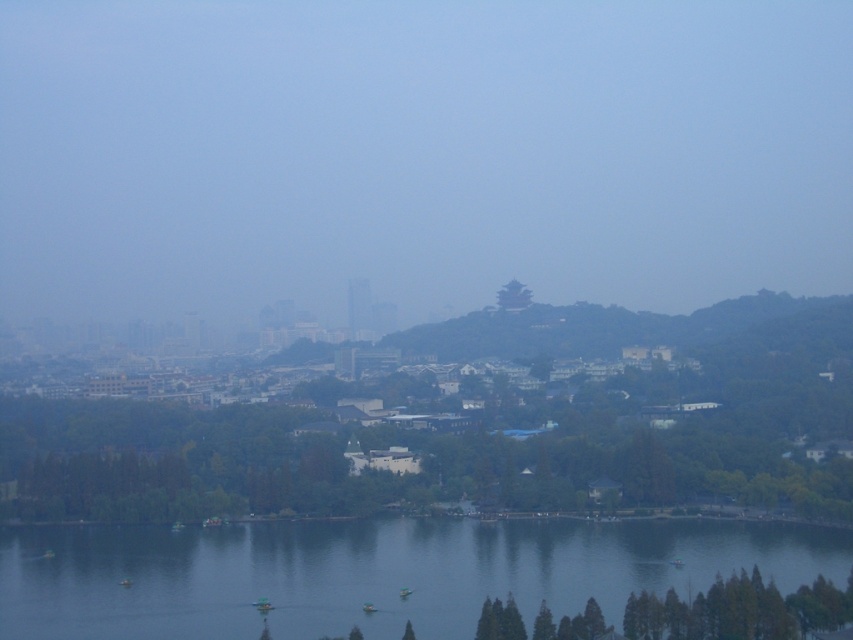
Question: Does clear blue water at lower center appear over green matte pagoda at center?

Choices:
 (A) no
 (B) yes

Answer: (A)

Question: Can you confirm if clear blue water at lower center is wider than green matte pagoda at center?

Choices:
 (A) no
 (B) yes

Answer: (B)

Question: Does green matte tree at center have a larger size compared to green matte pagoda at center?

Choices:
 (A) no
 (B) yes

Answer: (B)

Question: Which of the following is the farthest from the observer?

Choices:
 (A) pyautogui.click(x=527, y=300)
 (B) pyautogui.click(x=578, y=566)
 (C) pyautogui.click(x=354, y=492)

Answer: (A)

Question: Which of the following is the farthest from the observer?

Choices:
 (A) clear blue water at lower center
 (B) green matte pagoda at center

Answer: (B)

Question: Which of the following is the farthest from the observer?

Choices:
 (A) clear blue water at lower center
 (B) green matte pagoda at center

Answer: (B)